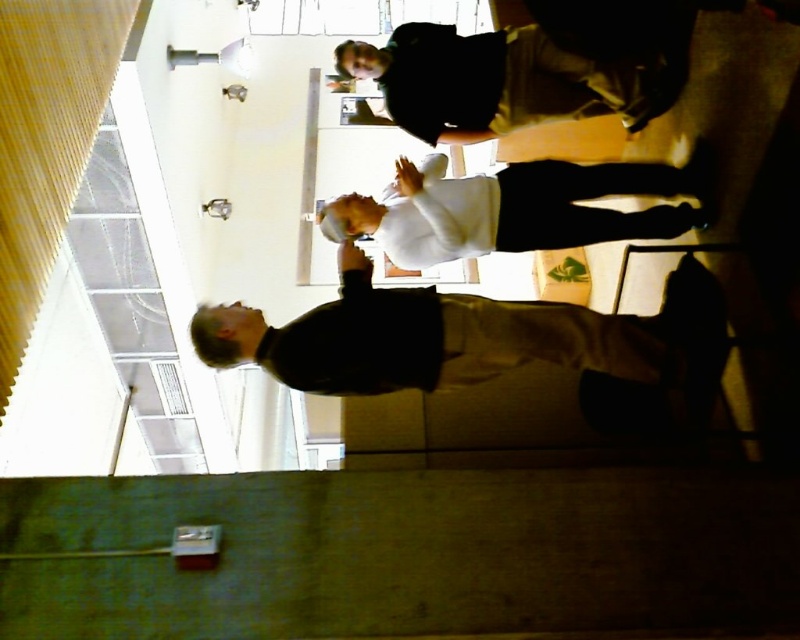
Looking at this image, you are standing in a room and see two people wearing the dark gray sweater at center and the white matte shirt at center. Which one is more to the left?

The dark gray sweater at center is more to the left side of the white matte shirt at center.

You are standing at the point labeled point (509, 192) and want to walk towards the point labeled point (442, 387). Given the rotated orientation of the image, in which direction should you move relative to the image?

Since point (442, 387) is in front of point (509, 192), you should move forward in the direction of the point (442, 387) relative to your current position at point (509, 192).